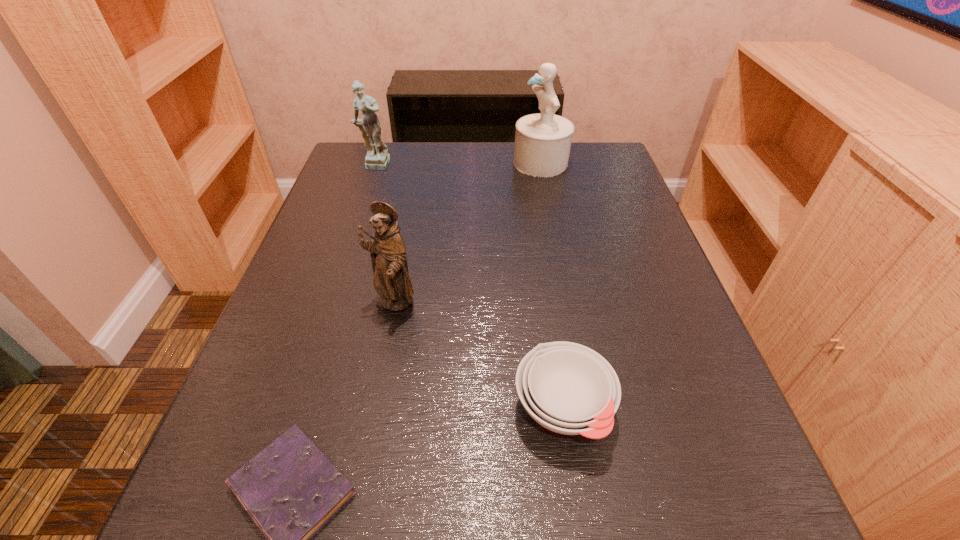
Locate an element on the screen. Image resolution: width=960 pixels, height=540 pixels. vacant area at the near left corner is located at coordinates (225, 504).

At what (x,y) coordinates should I click in order to perform the action: click on blank area at the far right corner. Please return your answer as a coordinate pair (x, y). This screenshot has height=540, width=960. Looking at the image, I should click on (598, 144).

Find the location of a particular element. free area in between the leftmost figurine and the rightmost figurine is located at coordinates (458, 165).

Identify the location of free space between the rightmost figurine and the soup bowl. (552, 286).

In order to click on empty space between the fourth tallest object and the rightmost figurine in this screenshot , I will do `click(552, 286)`.

At what (x,y) coordinates should I click in order to perform the action: click on free spot between the second figurine from right to left and the rightmost figurine. Please return your answer as a coordinate pair (x, y). Looking at the image, I should click on (468, 234).

Locate an element on the screen. free space between the rightmost figurine and the second figurine from left to right is located at coordinates (468, 234).

Find the location of a particular element. free space that is in between the second figurine from left to right and the soup bowl is located at coordinates (478, 357).

The height and width of the screenshot is (540, 960). Find the location of `free space between the nearest figurine and the soup bowl`. free space between the nearest figurine and the soup bowl is located at coordinates (478, 357).

Where is `free space between the rightmost figurine and the leftmost figurine`? Image resolution: width=960 pixels, height=540 pixels. free space between the rightmost figurine and the leftmost figurine is located at coordinates (458, 165).